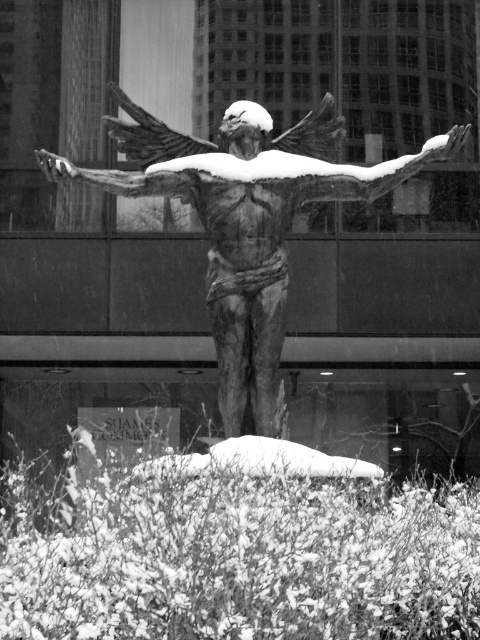
You are an art student analyzing the statue in the snow. You notice the rustic stone eagle at center and the smooth bronze arm at center. Which object is positioned closer to you?

The rustic stone eagle at center is closer to the viewer than the smooth bronze arm at center.

You are an art student analyzing the statue. Which part of the statue, the rustic stone eagle at center or the smooth bronze arm at center, has a greater height?

The rustic stone eagle at center is taller than the smooth bronze arm at center.